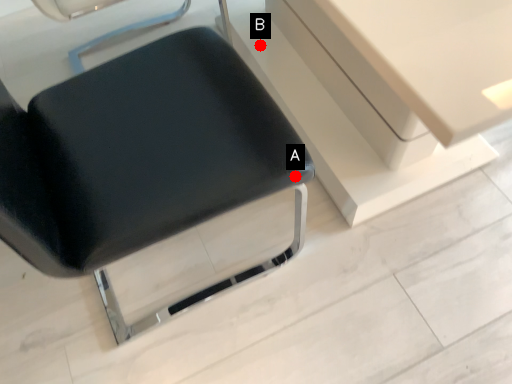
Question: Two points are circled on the image, labeled by A and B beside each circle. Which point appears farthest from the camera in this image?

Choices:
 (A) A is further
 (B) B is further

Answer: (B)